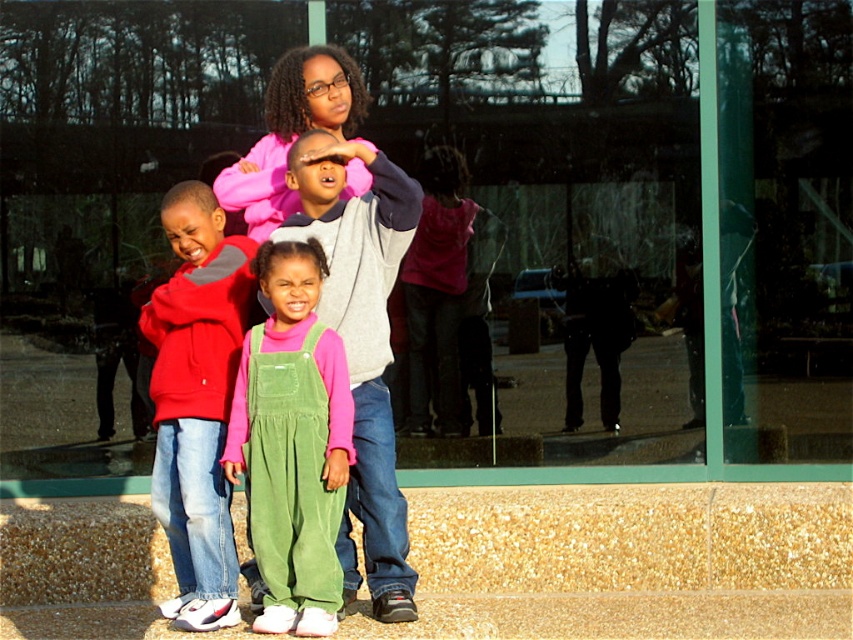
You are a photographer trying to capture a clear shot of the red hoodie at left and the pink fleece sweatshirt at center. Since the image has a window reflection, which clothing item is more likely to be obscured by the reflection?

The red hoodie at left is positioned under the pink fleece sweatshirt at center, so the reflection on the window would likely obscure the red hoodie at left first because it is lower in the frame.

You are a photographer trying to capture a group photo of the children. You want to ensure that both the green corduroy overalls at center and the red hoodie at left are in focus. If your camera can only focus on objects within a 10 inch range, will both children be in focus?

The green corduroy overalls at center and red hoodie at left are 12.50 inches apart from each other. Since the distance between them exceeds the camera focus range of 10 inches, both children may not be in focus simultaneously.

In the scene shown: You are a photographer trying to capture a group photo of the children. You notice the red hoodie at left and the pink fleece sweatshirt at center. Which child should you ask to move closer to the center to balance the visual weight of the group photo?

The red hoodie at left has a lesser width compared to the pink fleece sweatshirt at center, so you should ask the child wearing the red hoodie at left to move closer to the center to balance the visual weight.